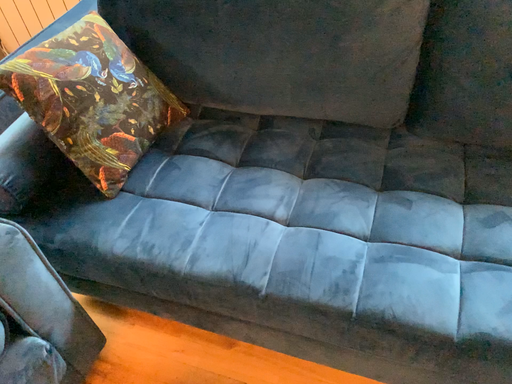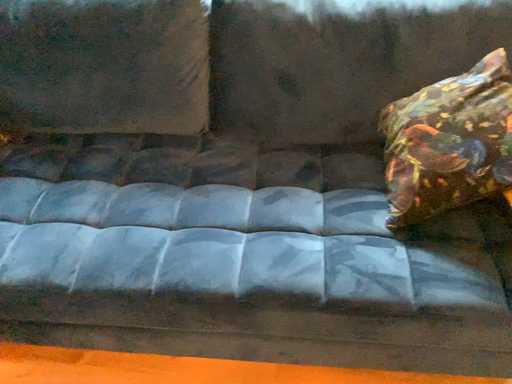
Question: How did the camera likely rotate when shooting the video?

Choices:
 (A) rotated right
 (B) rotated left

Answer: (A)